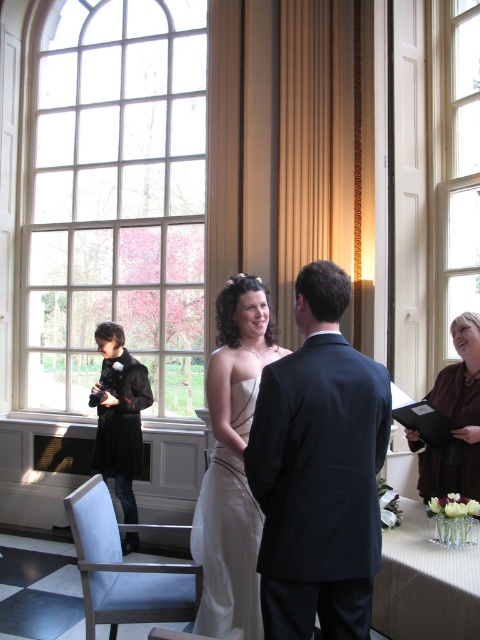
Based on the photo, does dark blue suit at center appear on the right side of brown fuzzy coat at lower right?

Incorrect, dark blue suit at center is not on the right side of brown fuzzy coat at lower right.

Who is lower down, dark blue suit at center or brown fuzzy coat at lower right?

brown fuzzy coat at lower right is below.

Between point (326, 577) and point (476, 369), which one is positioned behind?

The point (476, 369) is behind.

Image resolution: width=480 pixels, height=640 pixels. I want to click on dark blue suit at center, so click(319, 470).

In the scene shown: Between brown fuzzy coat at lower right and black wool coat at left, which one is positioned lower?

black wool coat at left

Which is more to the left, brown fuzzy coat at lower right or black wool coat at left?

From the viewer's perspective, black wool coat at left appears more on the left side.

Locate an element on the screen. This screenshot has height=640, width=480. brown fuzzy coat at lower right is located at coordinates (456, 419).

Can you confirm if clear glass window at upper right is positioned above clear glass vase at lower right?

Indeed, clear glass window at upper right is positioned over clear glass vase at lower right.

Who is more forward, (476, 285) or (467, 582)?

Point (467, 582) is in front.

Is point (444, 38) behind point (462, 600)?

That is True.

I want to click on clear glass window at upper right, so click(x=456, y=173).